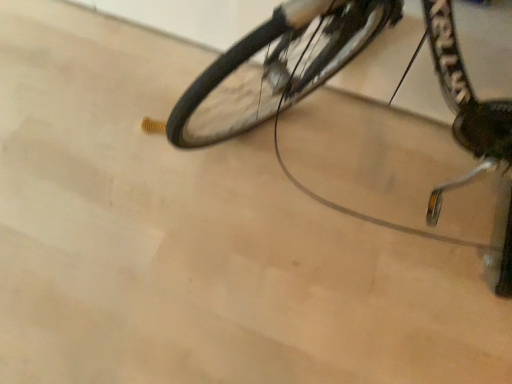
Question: Does black rubber tire at center lie behind black rubber bicycle at center?

Choices:
 (A) yes
 (B) no

Answer: (A)

Question: From the image's perspective, is black rubber tire at center below black rubber bicycle at center?

Choices:
 (A) no
 (B) yes

Answer: (A)

Question: From a real-world perspective, is black rubber tire at center on black rubber bicycle at center?

Choices:
 (A) no
 (B) yes

Answer: (A)

Question: Can you confirm if black rubber tire at center is positioned to the left of black rubber bicycle at center?

Choices:
 (A) no
 (B) yes

Answer: (B)

Question: Considering the relative sizes of black rubber tire at center and black rubber bicycle at center in the image provided, is black rubber tire at center shorter than black rubber bicycle at center?

Choices:
 (A) no
 (B) yes

Answer: (B)

Question: Can you confirm if black rubber tire at center is bigger than black rubber bicycle at center?

Choices:
 (A) no
 (B) yes

Answer: (A)

Question: Considering the relative sizes of black rubber bicycle at center and black rubber tire at center in the image provided, is black rubber bicycle at center wider than black rubber tire at center?

Choices:
 (A) no
 (B) yes

Answer: (B)

Question: Is black rubber bicycle at center to the right of black rubber tire at center from the viewer's perspective?

Choices:
 (A) yes
 (B) no

Answer: (A)

Question: Can you see black rubber bicycle at center touching black rubber tire at center?

Choices:
 (A) yes
 (B) no

Answer: (A)

Question: Is black rubber bicycle at center not within black rubber tire at center?

Choices:
 (A) yes
 (B) no

Answer: (A)

Question: Is black rubber bicycle at center aimed at black rubber tire at center?

Choices:
 (A) no
 (B) yes

Answer: (A)

Question: Is black rubber bicycle at center looking in the opposite direction of black rubber tire at center?

Choices:
 (A) no
 (B) yes

Answer: (B)

Question: Would you say black rubber tire at center is to the left or to the right of black rubber bicycle at center in the picture?

Choices:
 (A) right
 (B) left

Answer: (B)